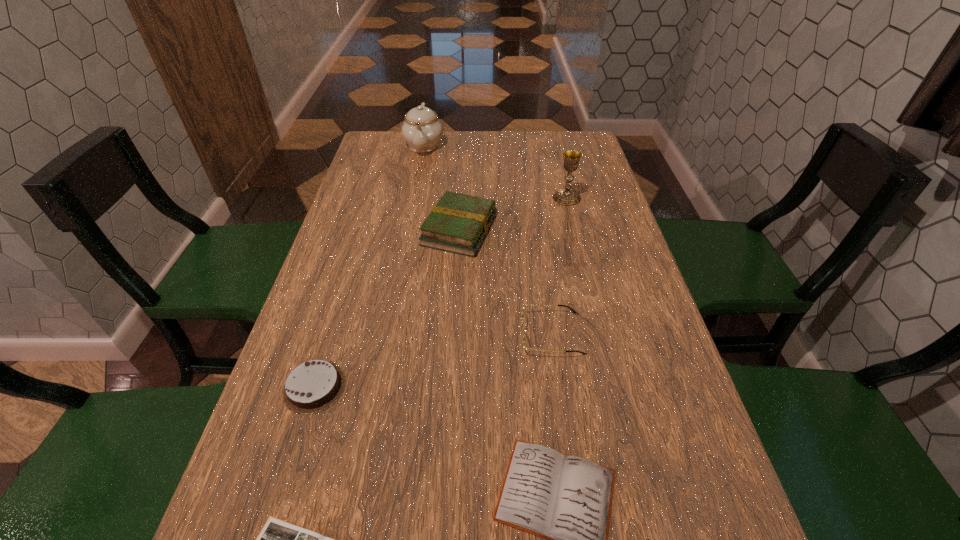
I want to click on vacant space located on the front of the third tallest object, so (x=452, y=366).

Where is `free space located on the lenses of the fourth shortest object`? free space located on the lenses of the fourth shortest object is located at coordinates (492, 334).

At what (x,y) coordinates should I click in order to perform the action: click on vacant region located 0.150m on the lenses of the fourth shortest object. Please return your answer as a coordinate pair (x, y). Image resolution: width=960 pixels, height=540 pixels. Looking at the image, I should click on (449, 334).

Find the location of a particular element. The width and height of the screenshot is (960, 540). vacant space located on the lenses of the fourth shortest object is located at coordinates (372, 334).

Find the location of a particular element. vacant space situated on the right of the third shortest object is located at coordinates point(553,387).

What are the coordinates of `object at the far edge` in the screenshot? It's located at (422, 130).

Where is `chinaware positioned at the left edge`? Image resolution: width=960 pixels, height=540 pixels. chinaware positioned at the left edge is located at coordinates (422, 130).

Image resolution: width=960 pixels, height=540 pixels. Find the location of `chocolate cake at the left edge`. chocolate cake at the left edge is located at coordinates (313, 386).

You are a GUI agent. You are given a task and a screenshot of the screen. Output one action in this format:
    pyautogui.click(x=<x>, y=<y>)
    Task: Click on the object located at the right edge
    The image size is (960, 540).
    Given the screenshot: What is the action you would take?
    pyautogui.click(x=567, y=197)

You are a GUI agent. You are given a task and a screenshot of the screen. Output one action in this format:
    pyautogui.click(x=<x>, y=<y>)
    Task: Click on the object present at the far left corner
    The image size is (960, 540).
    Given the screenshot: What is the action you would take?
    pyautogui.click(x=422, y=130)